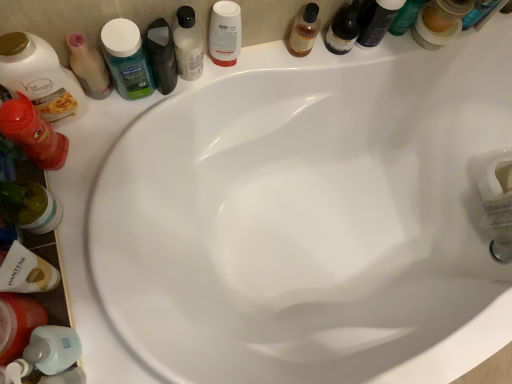
What do you see at coordinates (53, 349) in the screenshot?
I see `translucent plastic pump bottle at lower left, which is counted as the 4th toiletry, starting from the left` at bounding box center [53, 349].

What do you see at coordinates (18, 324) in the screenshot? I see `translucent plastic mouthwash at lower left, which is the 6th mouthwash in top-to-bottom order` at bounding box center [18, 324].

How much space does rubberized red bottle at left, placed as the first toiletry when sorted from left to right, occupy horizontally?

rubberized red bottle at left, placed as the first toiletry when sorted from left to right, is 3.30 inches wide.

This screenshot has width=512, height=384. I want to click on white glossy mouthwash at upper center, the second mouthwash viewed from the right, so click(225, 33).

Identify the location of translucent plastic bottle at upper right, the 7th toiletry positioned from the left. (343, 29).

Is white matte shampoo bottle at lower left, which appears as the 3th toiletry when viewed from the left, spatially inside white matte bottle at upper center, arranged as the fourth mouthwash when viewed from the left, or outside of it?

white matte shampoo bottle at lower left, which appears as the 3th toiletry when viewed from the left, is outside white matte bottle at upper center, arranged as the fourth mouthwash when viewed from the left.

Considering the relative sizes of white matte shampoo bottle at lower left, the 6th toiletry in the right-to-left sequence, and white matte bottle at upper center, marked as the third mouthwash in a right-to-left arrangement, in the image provided, is white matte shampoo bottle at lower left, the 6th toiletry in the right-to-left sequence, wider than white matte bottle at upper center, marked as the third mouthwash in a right-to-left arrangement,?

Correct, the width of white matte shampoo bottle at lower left, the 6th toiletry in the right-to-left sequence, exceeds that of white matte bottle at upper center, marked as the third mouthwash in a right-to-left arrangement.

Does white matte shampoo bottle at lower left, the 6th toiletry in the right-to-left sequence, turn towards white matte bottle at upper center, which ranks as the fourth mouthwash in bottom-to-top order?

No, white matte shampoo bottle at lower left, the 6th toiletry in the right-to-left sequence, is not facing towards white matte bottle at upper center, which ranks as the fourth mouthwash in bottom-to-top order.

Does white matte shampoo bottle at lower left, the 6th toiletry in the right-to-left sequence, have a larger size compared to white matte bottle at upper center, marked as the third mouthwash in a right-to-left arrangement?

Correct, white matte shampoo bottle at lower left, the 6th toiletry in the right-to-left sequence, is larger in size than white matte bottle at upper center, marked as the third mouthwash in a right-to-left arrangement.

From the picture: Can you confirm if translucent plastic mouthwash at left, placed as the second mouthwash when sorted from bottom to top, is bigger than white matte bottle at upper center, which ranks as the fourth mouthwash in bottom-to-top order?

No.

Is point (104, 89) closer or farther from the camera than point (184, 37)?

Point (104, 89) is farther from the camera than point (184, 37).

Does translucent plastic mouthwash at left, placed as the second mouthwash when sorted from bottom to top, lie in front of white matte bottle at upper center, arranged as the fourth mouthwash when viewed from the left?

Yes.

Is green matte bottle at upper right not close to translucent plastic mouthwash at lower left, placed as the sixth mouthwash when sorted from right to left?

Actually, green matte bottle at upper right and translucent plastic mouthwash at lower left, placed as the sixth mouthwash when sorted from right to left, are a little close together.

From the image's perspective, which one is positioned higher, green matte bottle at upper right or translucent plastic mouthwash at lower left, the 1th mouthwash viewed from the left?

green matte bottle at upper right appears higher in the image.

Which object is closer to the camera, green matte bottle at upper right or translucent plastic mouthwash at lower left, the 1th mouthwash viewed from the left?

translucent plastic mouthwash at lower left, the 1th mouthwash viewed from the left, is closer to the camera.

Is green matte bottle at upper right turned away from translucent plastic mouthwash at lower left, which is the 6th mouthwash in top-to-bottom order?

No.

From a real-world perspective, which object stands above the other?

In real-world perspective, green matte bottle at upper right is above.

Where is `bottle above the translucent amber bottle at upper center, placed as the third toiletry when sorted from right to left (from a real-world perspective)`? bottle above the translucent amber bottle at upper center, placed as the third toiletry when sorted from right to left (from a real-world perspective) is located at coordinates (405, 17).

Who is shorter, green matte bottle at upper right or translucent amber bottle at upper center, placed as the third toiletry when sorted from right to left?

translucent amber bottle at upper center, placed as the third toiletry when sorted from right to left.

Looking at this image, looking at their sizes, would you say green matte bottle at upper right is wider or thinner than translucent amber bottle at upper center, placed as the third toiletry when sorted from right to left?

In the image, green matte bottle at upper right appears to be more narrow than translucent amber bottle at upper center, placed as the third toiletry when sorted from right to left.

How much distance is there between matte white lotion at left, positioned as the 7th toiletry in right-to-left order, and white matte shampoo bottle at lower left, the 6th toiletry in the right-to-left sequence?

They are 11.29 inches apart.

Could you tell me if matte white lotion at left, positioned as the 7th toiletry in right-to-left order, is turned towards white matte shampoo bottle at lower left, which appears as the 3th toiletry when viewed from the left?

Yes, matte white lotion at left, positioned as the 7th toiletry in right-to-left order, is facing white matte shampoo bottle at lower left, which appears as the 3th toiletry when viewed from the left.

Can you confirm if matte white lotion at left, the second toiletry in the left-to-right sequence, is thinner than white matte shampoo bottle at lower left, which appears as the 3th toiletry when viewed from the left?

No, matte white lotion at left, the second toiletry in the left-to-right sequence, is not thinner than white matte shampoo bottle at lower left, which appears as the 3th toiletry when viewed from the left.

Considering the relative sizes of matte white lotion at left, positioned as the 7th toiletry in right-to-left order, and white matte shampoo bottle at lower left, the 6th toiletry in the right-to-left sequence, in the image provided, is matte white lotion at left, positioned as the 7th toiletry in right-to-left order, shorter than white matte shampoo bottle at lower left, the 6th toiletry in the right-to-left sequence,?

Incorrect, the height of matte white lotion at left, positioned as the 7th toiletry in right-to-left order, does not fall short of that of white matte shampoo bottle at lower left, the 6th toiletry in the right-to-left sequence.

Can you confirm if white glossy mouthwash at upper center, which is counted as the fifth mouthwash, starting from the left, is smaller than green matte bottle at upper right?

Correct, white glossy mouthwash at upper center, which is counted as the fifth mouthwash, starting from the left, occupies less space than green matte bottle at upper right.

Is white glossy mouthwash at upper center, the second mouthwash from the top, further to the viewer compared to green matte bottle at upper right?

That is False.

Considering the positions of objects white glossy mouthwash at upper center, which is counted as the fifth mouthwash, starting from the left, and green matte bottle at upper right in the image provided, who is more to the right, white glossy mouthwash at upper center, which is counted as the fifth mouthwash, starting from the left, or green matte bottle at upper right?

From the viewer's perspective, green matte bottle at upper right appears more on the right side.

Does point (215, 54) come farther from viewer compared to point (420, 4)?

No, it is not.

Could you measure the distance between translucent plastic mouthwash at lower left, which is the 6th mouthwash in top-to-bottom order, and white matte bottle at upper center, which ranks as the fourth mouthwash in bottom-to-top order?

The distance of translucent plastic mouthwash at lower left, which is the 6th mouthwash in top-to-bottom order, from white matte bottle at upper center, which ranks as the fourth mouthwash in bottom-to-top order, is 21.30 inches.

Is translucent plastic mouthwash at lower left, the first mouthwash ordered from the bottom, facing towards white matte bottle at upper center, which ranks as the 3th mouthwash in top-to-bottom order?

No, translucent plastic mouthwash at lower left, the first mouthwash ordered from the bottom, is not aimed at white matte bottle at upper center, which ranks as the 3th mouthwash in top-to-bottom order.

From the image's perspective, relative to white matte bottle at upper center, which ranks as the 3th mouthwash in top-to-bottom order, is translucent plastic mouthwash at lower left, the first mouthwash ordered from the bottom, above or below?

translucent plastic mouthwash at lower left, the first mouthwash ordered from the bottom, is situated lower than white matte bottle at upper center, which ranks as the 3th mouthwash in top-to-bottom order, in the image.

Which is more to the left, translucent plastic mouthwash at lower left, placed as the sixth mouthwash when sorted from right to left, or white matte bottle at upper center, which ranks as the fourth mouthwash in bottom-to-top order?

translucent plastic mouthwash at lower left, placed as the sixth mouthwash when sorted from right to left.

Where is `the 3rd toiletry in front of the white matte bottle at upper center, which ranks as the fourth mouthwash in bottom-to-top order, starting your count from the anchor`? the 3rd toiletry in front of the white matte bottle at upper center, which ranks as the fourth mouthwash in bottom-to-top order, starting your count from the anchor is located at coordinates (27, 272).

At what (x,y) coordinates should I click in order to perform the action: click on the 2nd mouthwash positioned above the translucent plastic mouthwash at left, arranged as the 5th mouthwash when viewed from the top (from a real-world perspective). Please return your answer as a coordinate pair (x, y). The height and width of the screenshot is (384, 512). Looking at the image, I should click on (188, 44).

When comparing their distances from matte black bottle at upper right, which appears as the eighth toiletry when viewed from the left, does rubberized red bottle at left, placed as the first toiletry when sorted from left to right, or matte white lotion at left, positioned as the 7th toiletry in right-to-left order, seem closer?

matte white lotion at left, positioned as the 7th toiletry in right-to-left order, is positioned closer to the anchor matte black bottle at upper right, which appears as the eighth toiletry when viewed from the left.

When comparing their distances from translucent plastic bottle at upper right, which is the second toiletry from right to left, does white matte bottle at upper center, arranged as the fourth mouthwash when viewed from the left, or matte white lotion at left, positioned as the 7th toiletry in right-to-left order, seem closer?

white matte bottle at upper center, arranged as the fourth mouthwash when viewed from the left.

Estimate the real-world distances between objects in this image. Which object is closer to translucent plastic mouthwash at lower left, the 1th mouthwash viewed from the left, matte white lotion at left, the second toiletry in the left-to-right sequence, or white glossy mouthwash at upper center, which is counted as the fifth mouthwash, starting from the left?

matte white lotion at left, the second toiletry in the left-to-right sequence, is positioned closer to the anchor translucent plastic mouthwash at lower left, the 1th mouthwash viewed from the left.

Which object lies nearer to the anchor point translucent plastic mouthwash at lower left, placed as the sixth mouthwash when sorted from right to left, matte white lotion at left, positioned as the 7th toiletry in right-to-left order, or white matte shampoo bottle at lower left, which appears as the 3th toiletry when viewed from the left?

white matte shampoo bottle at lower left, which appears as the 3th toiletry when viewed from the left, is closer to translucent plastic mouthwash at lower left, placed as the sixth mouthwash when sorted from right to left.

Considering their positions, is matte black bottle at upper right, the 1th toiletry positioned from the right, positioned further to translucent plastic pump bottle at lower left, which is counted as the 4th toiletry, starting from the left, than green plastic mouthwash at upper left, which ranks as the fourth mouthwash in top-to-bottom order?

Based on the image, matte black bottle at upper right, the 1th toiletry positioned from the right, appears to be further to translucent plastic pump bottle at lower left, which is counted as the 4th toiletry, starting from the left.

Estimate the real-world distances between objects in this image. Which object is further from translucent plastic mouthwash at left, placed as the second mouthwash when sorted from bottom to top, white glossy mouthwash at upper center, the second mouthwash from the top, or green matte bottle at upper right?

Based on the image, green matte bottle at upper right appears to be further to translucent plastic mouthwash at left, placed as the second mouthwash when sorted from bottom to top.

Based on their spatial positions, is white glossy mouthwash at upper center, the second mouthwash viewed from the right, or green plastic mouthwash at upper left, positioned as the 3th mouthwash in left-to-right order, further from white matte bottle at upper center, marked as the third mouthwash in a right-to-left arrangement?

green plastic mouthwash at upper left, positioned as the 3th mouthwash in left-to-right order.

Which object lies nearer to the anchor point green plastic mouthwash at upper left, positioned as the 3th mouthwash in left-to-right order, matte white lotion at left, positioned as the 7th toiletry in right-to-left order, or white matte shampoo bottle at lower left, which appears as the 3th toiletry when viewed from the left?

Among the two, matte white lotion at left, positioned as the 7th toiletry in right-to-left order, is located nearer to green plastic mouthwash at upper left, positioned as the 3th mouthwash in left-to-right order.

Locate an element on the screen. This screenshot has width=512, height=384. mouthwash between white matte bottle at upper center, which ranks as the fourth mouthwash in bottom-to-top order, and matte black bottle at upper right, which appears as the eighth toiletry when viewed from the left is located at coordinates (225, 33).

You are a GUI agent. You are given a task and a screenshot of the screen. Output one action in this format:
    pyautogui.click(x=<x>, y=<y>)
    Task: Click on the mouthwash located between white matte bottle at upper center, marked as the third mouthwash in a right-to-left arrangement, and green matte bottle at upper right in the left-right direction
    
    Given the screenshot: What is the action you would take?
    coord(225,33)

Find the location of a particular element. Image resolution: width=512 pixels, height=384 pixels. mouthwash that lies between translucent plastic mouthwash at left, arranged as the 5th mouthwash when viewed from the top, and translucent plastic pump bottle at lower left, which is counted as the 4th toiletry, starting from the left, from top to bottom is located at coordinates (18, 324).

This screenshot has height=384, width=512. I want to click on bottle between rubberized red bottle at left, acting as the eighth toiletry starting from the right, and translucent plastic mouthwash at upper right, acting as the first mouthwash starting from the top, so click(405, 17).